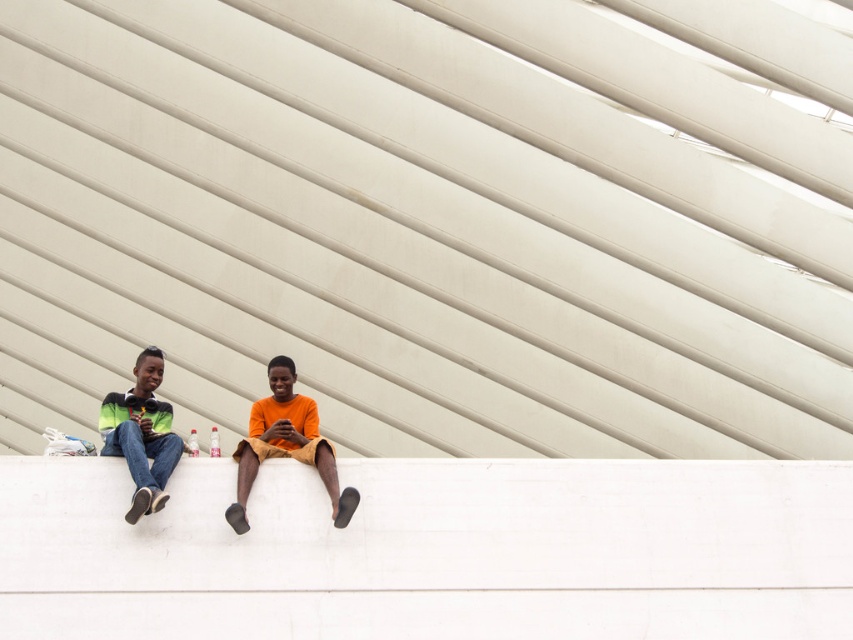
Question: Is orange matte shirt at center wider than green-yellow striped shirt at left?

Choices:
 (A) no
 (B) yes

Answer: (B)

Question: Can you confirm if orange matte shirt at center is positioned to the left of green-yellow striped shirt at left?

Choices:
 (A) no
 (B) yes

Answer: (A)

Question: Is orange matte shirt at center thinner than green-yellow striped shirt at left?

Choices:
 (A) no
 (B) yes

Answer: (A)

Question: Which of the following is the farthest from the observer?

Choices:
 (A) green-yellow striped shirt at left
 (B) orange matte shirt at center

Answer: (B)

Question: Which point appears closest to the camera in this image?

Choices:
 (A) (256, 451)
 (B) (137, 484)

Answer: (B)